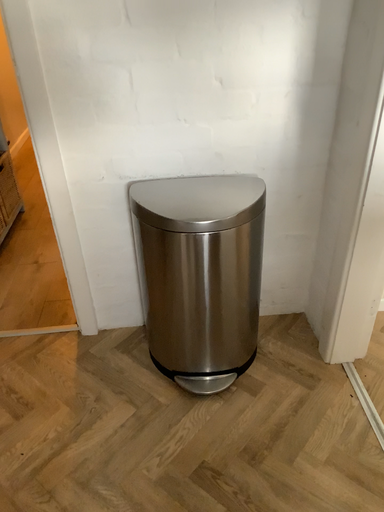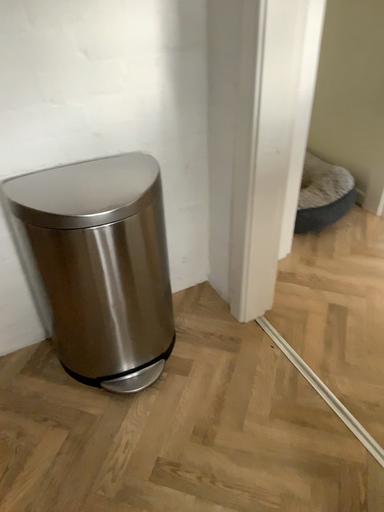
Question: How did the camera likely rotate when shooting the video?

Choices:
 (A) rotated left
 (B) rotated right

Answer: (B)